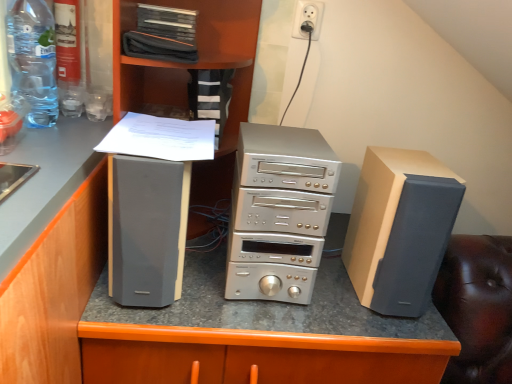
This screenshot has height=384, width=512. Identify the location of free space above matte gray speaker at left (from a real-world perspective). point(156,141).